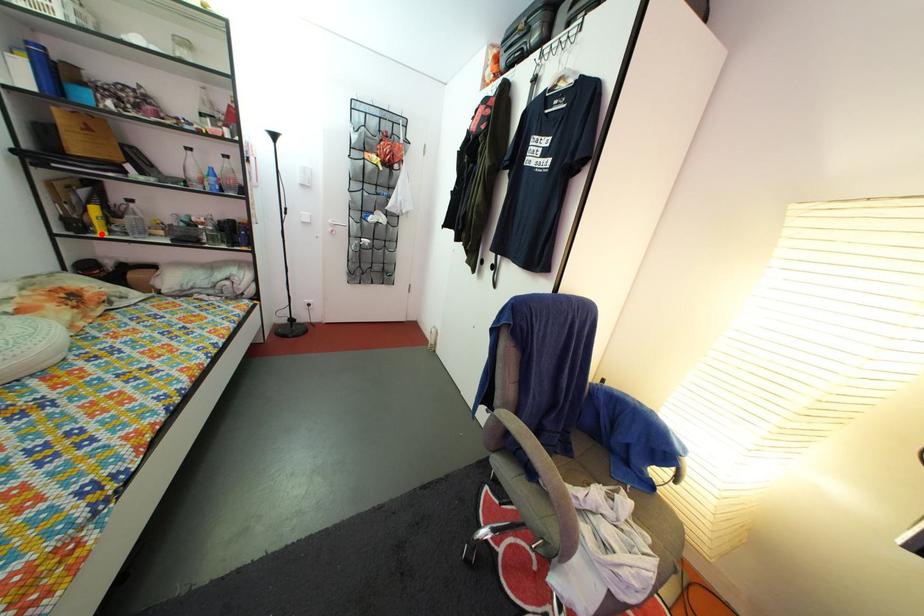
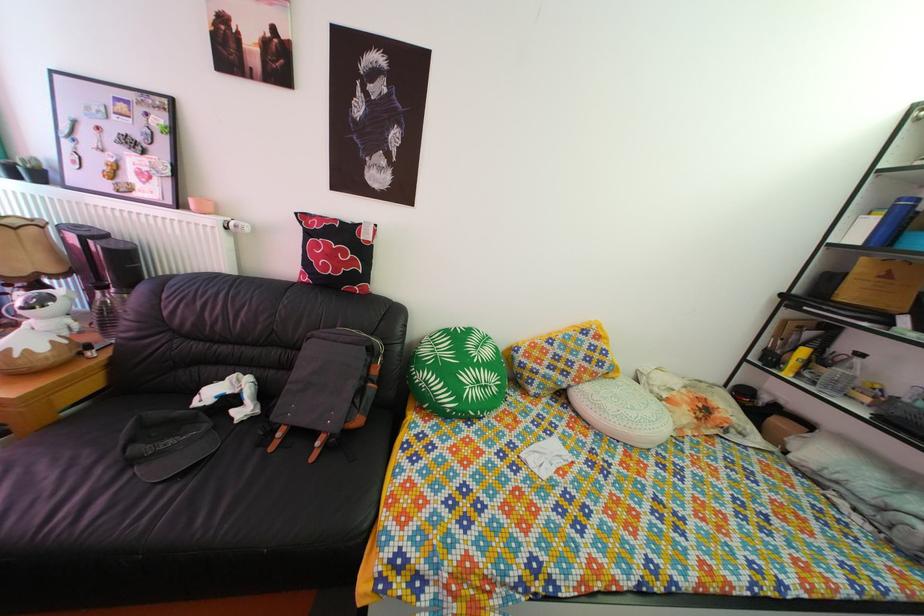
The point at the highlighted location is marked in the first image. Where is the corresponding point in the second image?

(794, 371)